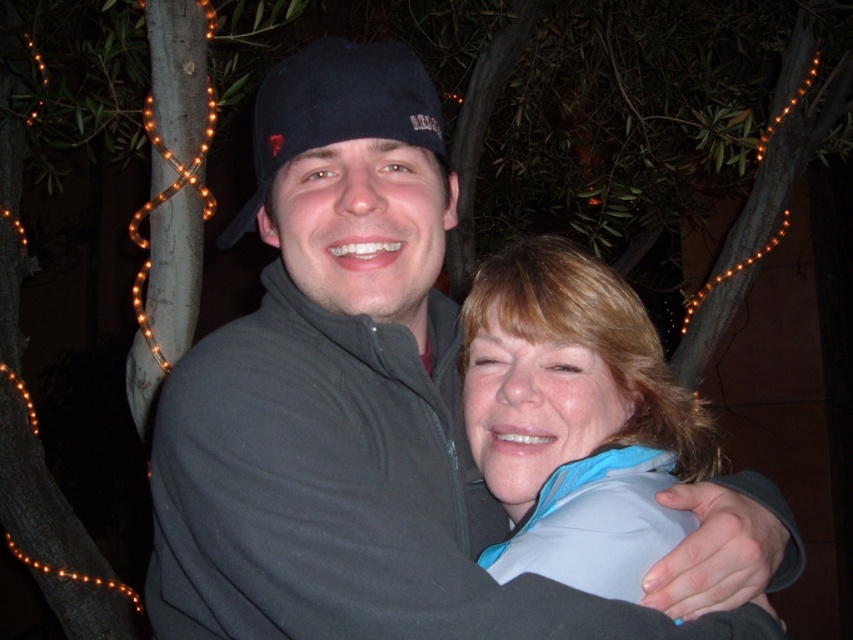
Question: Can you confirm if dark gray fleece at center is positioned below blue fabric at center?

Choices:
 (A) no
 (B) yes

Answer: (A)

Question: Does dark gray fleece at center have a greater width compared to blue fabric at center?

Choices:
 (A) yes
 (B) no

Answer: (A)

Question: Which object is farther from the camera taking this photo?

Choices:
 (A) blue fabric at center
 (B) dark gray fleece at center

Answer: (A)

Question: Does dark gray fleece at center appear on the left side of blue fabric at center?

Choices:
 (A) yes
 (B) no

Answer: (A)

Question: Which point is farther to the camera?

Choices:
 (A) blue fabric at center
 (B) dark gray fleece at center

Answer: (A)